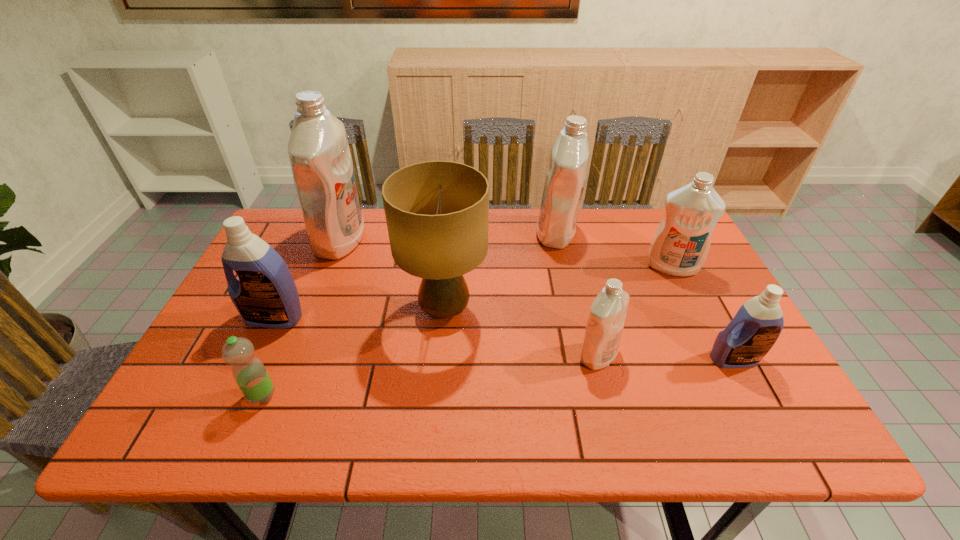
Find the location of `the right blue detergent`. the right blue detergent is located at coordinates (755, 328).

Where is `the nearest object`? Image resolution: width=960 pixels, height=540 pixels. the nearest object is located at coordinates (249, 372).

Where is `green water bottle`? green water bottle is located at coordinates (x=249, y=372).

Locate an element on the screen. This screenshot has width=960, height=540. vacant area situated 0.290m on the front of the tallest object is located at coordinates (301, 342).

You are a GUI agent. You are given a task and a screenshot of the screen. Output one action in this format:
    pyautogui.click(x=<x>, y=<y>)
    Task: Click on the vacant space situated on the front of the third smallest white detergent
    
    Given the screenshot: What is the action you would take?
    click(569, 296)

Find the location of a particular element. The width and height of the screenshot is (960, 540). free space located on the right of the lampshade is located at coordinates (599, 310).

Find the location of a particular element. The width and height of the screenshot is (960, 540). vacant area located 0.330m on the left of the third biggest white detergent is located at coordinates (531, 267).

Find the location of a particular element. vacant space located 0.220m on the right of the third nearest detergent is located at coordinates (391, 318).

Image resolution: width=960 pixels, height=540 pixels. I want to click on free space located on the back of the nearest white detergent, so click(579, 276).

I want to click on vacant region located on the back of the right blue detergent, so click(675, 247).